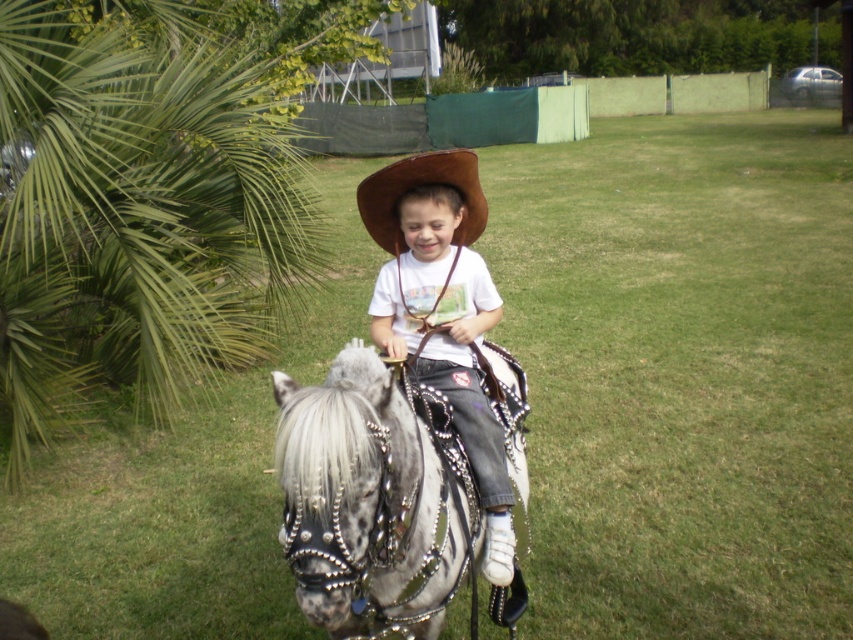
Question: Can you confirm if green leafy palm at left is bigger than matte brown cowboy hat at center?

Choices:
 (A) yes
 (B) no

Answer: (A)

Question: Can you confirm if matte brown cowboy hat at center is positioned below brown leather cowboy hat at center?

Choices:
 (A) no
 (B) yes

Answer: (B)

Question: Among these points, which one is nearest to the camera?

Choices:
 (A) (469, 152)
 (B) (289, 536)

Answer: (B)

Question: Estimate the real-world distances between objects in this image. Which object is closer to the matte brown cowboy hat at center?

Choices:
 (A) brown leather cowboy hat at center
 (B) speckled metallic horse at center

Answer: (B)

Question: Is green leafy palm at left thinner than brown leather cowboy hat at center?

Choices:
 (A) no
 (B) yes

Answer: (A)

Question: Which object is closer to the camera taking this photo?

Choices:
 (A) green leafy palm at left
 (B) matte brown cowboy hat at center
 (C) brown leather cowboy hat at center

Answer: (B)